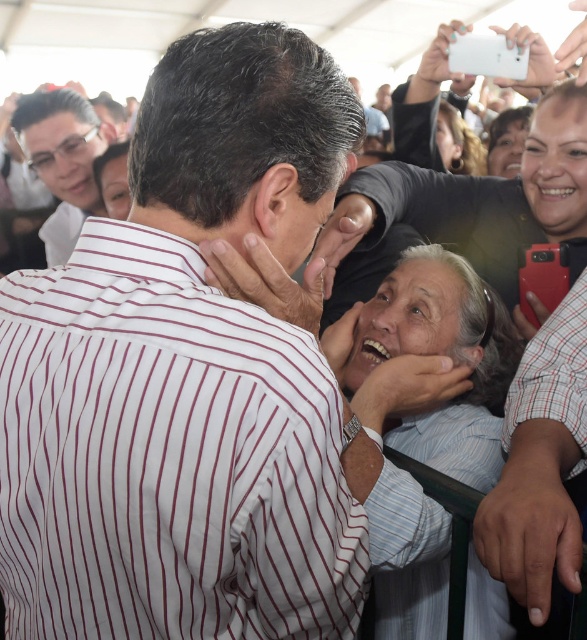
Looking at the scene, where is the white striped shirt at center in relation to the matte black glasses at upper left?

The white striped shirt at center is to the right of matte black glasses at upper left.

Based on the scene description, which object is smaller in size between the white striped shirt at center and the matte black glasses at upper left?

The white striped shirt at center is smaller in size compared to the matte black glasses at upper left according to the description.